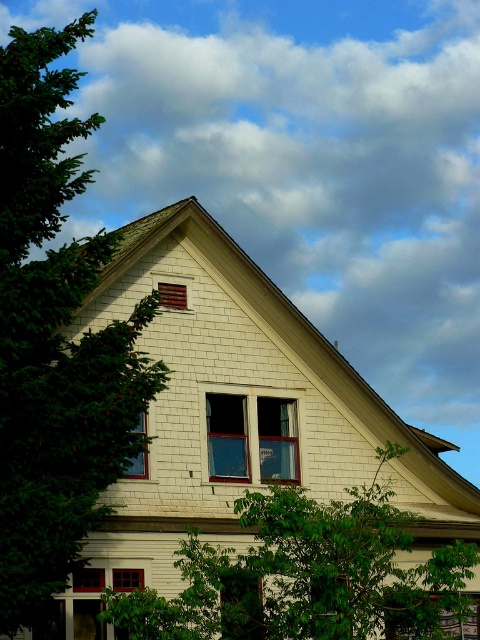
Is green leafy tree at lower center below clear glass window at center?

Yes, green leafy tree at lower center is below clear glass window at center.

Can you confirm if green leafy tree at lower center is shorter than clear glass window at center?

No, green leafy tree at lower center is not shorter than clear glass window at center.

Does point (347, 588) come closer to viewer compared to point (219, 397)?

Yes, it is in front of point (219, 397).

Where is `green leafy tree at lower center`? This screenshot has width=480, height=640. green leafy tree at lower center is located at coordinates (307, 573).

Between point (208, 456) and point (144, 465), which one is positioned behind?

The point (208, 456) is more distant.

Is point (248, 410) closer to camera compared to point (126, 468)?

No, it is behind (126, 468).

This screenshot has height=640, width=480. What are the coordinates of `clear glass window at center` in the screenshot? It's located at (252, 436).

Is matte wooden window at lower left taller than matte glass window at center?

In fact, matte wooden window at lower left may be shorter than matte glass window at center.

Does point (75, 577) come behind point (128, 579)?

That is False.

Who is more forward, (86, 577) or (135, 568)?

Point (86, 577) is more forward.

The height and width of the screenshot is (640, 480). Identify the location of matte wooden window at lower left. (87, 579).